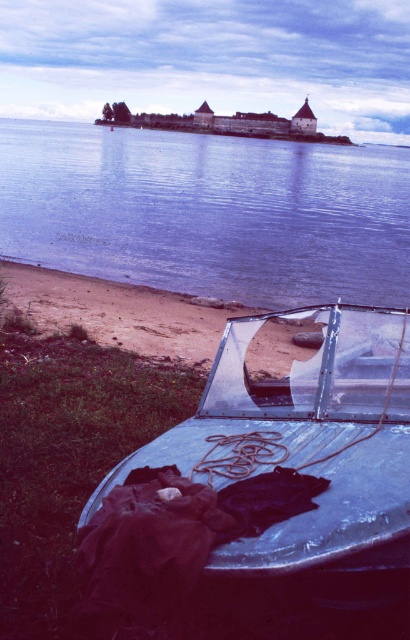
You are standing on the lakeside and want to board the metallic blue boat at lower center. Which direction should you move relative to the blue water at center to reach the boat?

The metallic blue boat at lower center is below the blue water at center, so you should move downward from the blue water at center to reach the boat.

You are a photographer planning to capture the blue water at center and the metallic blue boat at lower center in a single frame. Based on their sizes, which object should you focus on to ensure both are clearly visible in the photo?

The blue water at center is larger in size than the metallic blue boat at lower center, so focusing on the blue water at center would allow both objects to be clearly visible in the photo.

In the scene shown: You are standing at the lakeside and want to take a photo of the metallic blue boat at lower center without the blue water at center in the foreground. Is this possible given their positions?

The metallic blue boat at lower center is behind the blue water at center, so you can position yourself so that the blue water at center is not in front of the boat, allowing you to capture the boat without the water in the foreground.